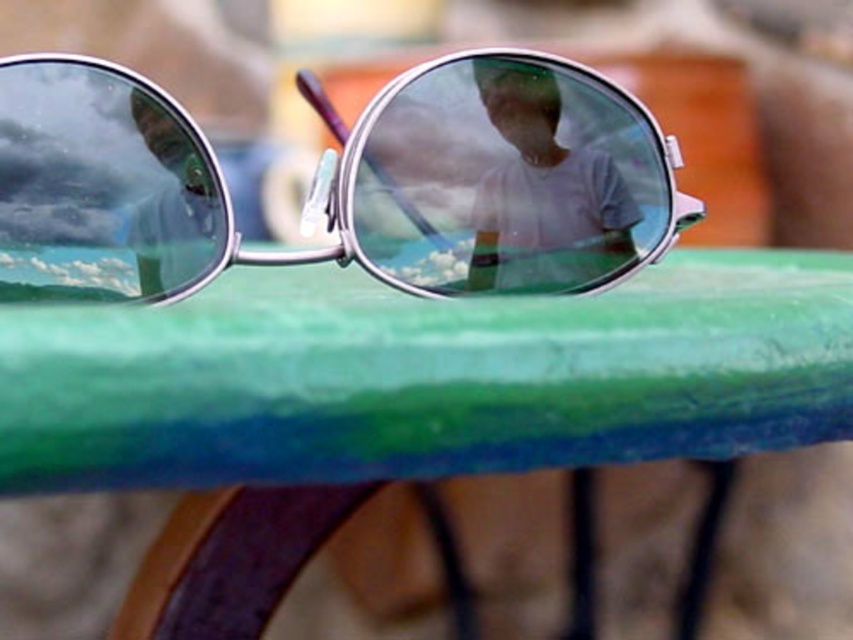
In the scene shown: Who is more distant from viewer, (426, 109) or (488, 241)?

Positioned behind is point (488, 241).

Is point (97, 134) positioned in front of point (560, 262)?

Yes.

Who is more forward, (115, 192) or (582, 208)?

Positioned in front is point (115, 192).

Identify the location of metallic round goggles at center. The width and height of the screenshot is (853, 640). tap(338, 182).